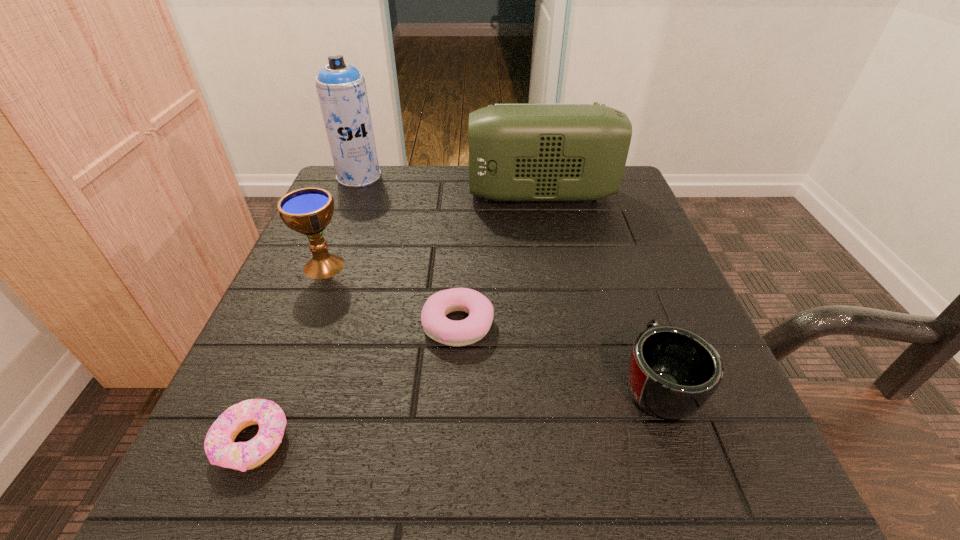
Find the location of `unoccupied position between the chalice and the second shortest object`. unoccupied position between the chalice and the second shortest object is located at coordinates (391, 295).

You are a GUI agent. You are given a task and a screenshot of the screen. Output one action in this format:
    pyautogui.click(x=<x>, y=<y>)
    Task: Click on the vacant space that is in between the second tallest object and the pastry
    
    Given the screenshot: What is the action you would take?
    pos(499,260)

Where is `free space between the tallest object and the radio_receiver`? The width and height of the screenshot is (960, 540). free space between the tallest object and the radio_receiver is located at coordinates (450, 186).

You are a GUI agent. You are given a task and a screenshot of the screen. Output one action in this format:
    pyautogui.click(x=<x>, y=<y>)
    Task: Click on the vacant space that is in between the second tallest object and the shortest object
    The height and width of the screenshot is (540, 960).
    Given the screenshot: What is the action you would take?
    pyautogui.click(x=396, y=318)

I want to click on the third closest object to the radio_receiver, so click(436, 325).

This screenshot has width=960, height=540. What are the coordinates of `object that is the fifth closest to the shortest object` in the screenshot? It's located at (341, 88).

At what (x,y) coordinates should I click in order to perform the action: click on free region that satisfies the following two spatial constraints: 1. on the front side of the chalice; 2. on the left side of the aerosol can. Please return your answer as a coordinate pair (x, y). Looking at the image, I should click on (323, 266).

I want to click on free location that satisfies the following two spatial constraints: 1. on the front-facing side of the radio_receiver; 2. on the front side of the doughnut, so click(x=588, y=441).

Where is `vacant region that satisfies the following two spatial constraints: 1. on the front-facing side of the radio_receiver; 2. on the front side of the second shortest object`? vacant region that satisfies the following two spatial constraints: 1. on the front-facing side of the radio_receiver; 2. on the front side of the second shortest object is located at coordinates (566, 325).

Where is `free space that satisfies the following two spatial constraints: 1. on the front-facing side of the second tallest object; 2. on the side of the third shortest object with the handle`? free space that satisfies the following two spatial constraints: 1. on the front-facing side of the second tallest object; 2. on the side of the third shortest object with the handle is located at coordinates (578, 384).